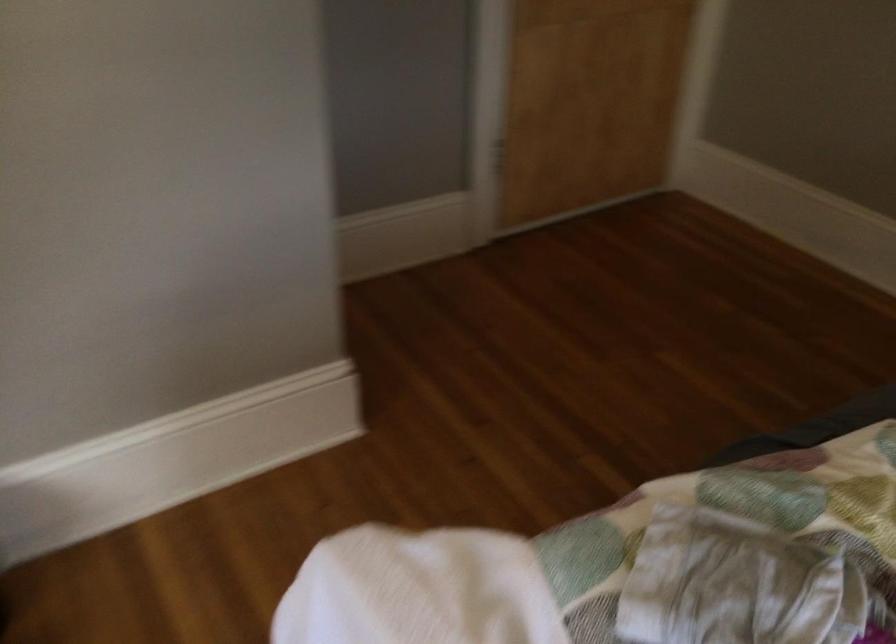
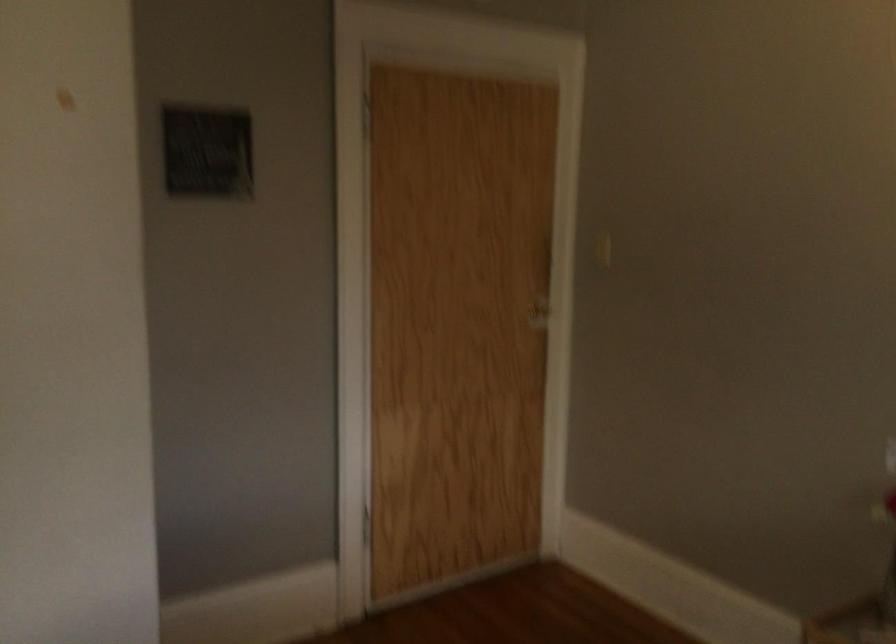
Based on the photo, which direction would the cameraman need to move to produce the second image?

The movement direction of the cameraman is right, backward.